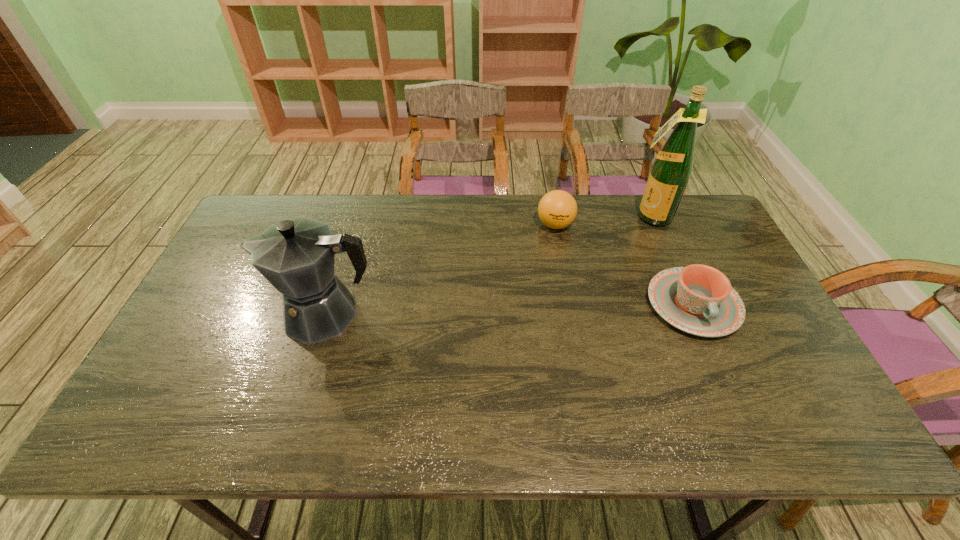
Identify the location of vacant area situated on the side with brand of the third object from right to left. click(544, 248).

The image size is (960, 540). What are the coordinates of `free point located 0.340m on the side with brand of the third object from right to left` in the screenshot? It's located at (516, 310).

Locate an element on the screen. free space located 0.170m on the front-facing side of the tallest object is located at coordinates (614, 252).

The width and height of the screenshot is (960, 540). What are the coordinates of `vacant space situated on the front-facing side of the tallest object` in the screenshot? It's located at (596, 271).

Find the location of a particular element. vacant space situated 0.160m on the front-facing side of the tallest object is located at coordinates (616, 250).

This screenshot has height=540, width=960. I want to click on ping-pong ball located in the far edge section of the desktop, so click(557, 209).

Locate an element on the screen. The height and width of the screenshot is (540, 960). liquor that is positioned at the far edge is located at coordinates (671, 170).

Find the location of `chinaware that is positioned at the right edge`. chinaware that is positioned at the right edge is located at coordinates (697, 299).

What are the coordinates of `liquor that is at the right edge` in the screenshot? It's located at (671, 170).

The height and width of the screenshot is (540, 960). In order to click on object positioned at the far right corner in this screenshot , I will do `click(671, 170)`.